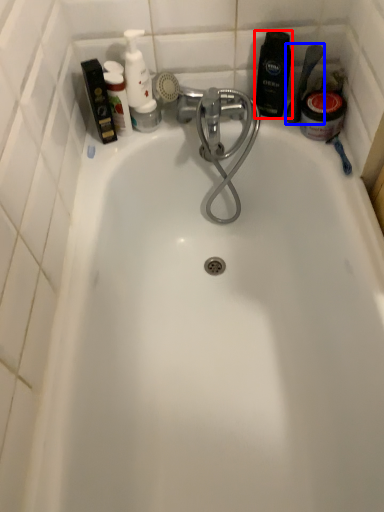
Question: Which object is further to the camera taking this photo, toiletry (highlighted by a red box) or shower (highlighted by a blue box)?

Choices:
 (A) toiletry
 (B) shower

Answer: (A)